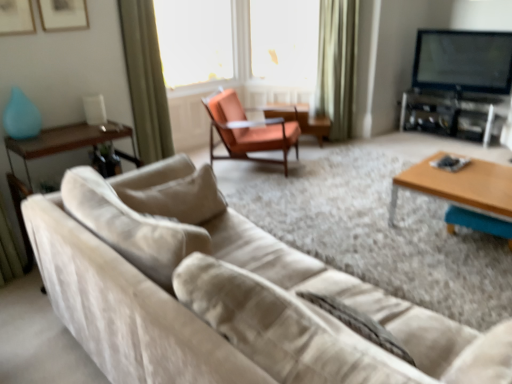
Measure the distance between point (137, 79) and camera.

The depth of point (137, 79) is 3.08 meters.

The width and height of the screenshot is (512, 384). Find the location of `transparent plastic screen at upper center, acting as the 2th window screen starting from the left`. transparent plastic screen at upper center, acting as the 2th window screen starting from the left is located at coordinates (284, 42).

Is suede beige couch at lower left next to green velvet curtain at upper center, positioned as the 2th curtain in front-to-back order, and touching it?

No, suede beige couch at lower left is not next to green velvet curtain at upper center, positioned as the 2th curtain in front-to-back order.

Is point (447, 362) farther from viewer compared to point (342, 75)?

No.

Considering the relative sizes of suede beige couch at lower left and green velvet curtain at upper center, which is counted as the second curtain, starting from the left, in the image provided, is suede beige couch at lower left shorter than green velvet curtain at upper center, which is counted as the second curtain, starting from the left,?

Yes.

Can you confirm if suede beige couch at lower left is smaller than green velvet curtain at upper center, positioned as the first curtain in back-to-front order?

No, suede beige couch at lower left is not smaller than green velvet curtain at upper center, positioned as the first curtain in back-to-front order.

Does green fabric curtain at upper left, acting as the second curtain starting from the back, turn towards transparent plastic window screen at upper center, which appears as the 1th window screen when viewed from the left?

No.

At what (x,y) coordinates should I click in order to perform the action: click on curtain located in front of the transparent plastic window screen at upper center, which appears as the 1th window screen when viewed from the left. Please return your answer as a coordinate pair (x, y). Image resolution: width=512 pixels, height=384 pixels. Looking at the image, I should click on (145, 80).

Considering the positions of objects green fabric curtain at upper left, marked as the first curtain in a front-to-back arrangement, and transparent plastic window screen at upper center, which ranks as the 2th window screen in right-to-left order, in the image provided, who is behind, green fabric curtain at upper left, marked as the first curtain in a front-to-back arrangement, or transparent plastic window screen at upper center, which ranks as the 2th window screen in right-to-left order,?

transparent plastic window screen at upper center, which ranks as the 2th window screen in right-to-left order, is further away from the camera.

From the image's perspective, would you say wooden/matte coffee table at right is shown under orange leather chair at center?

Indeed, from the image's perspective, wooden/matte coffee table at right is shown beneath orange leather chair at center.

From a real-world perspective, which is physically above, wooden/matte coffee table at right or orange leather chair at center?

From a 3D spatial view, orange leather chair at center is above.

Which is farther, (489, 166) or (232, 117)?

Positioned behind is point (232, 117).

Is wooden/matte coffee table at right taller or shorter than orange leather chair at center?

In the image, wooden/matte coffee table at right appears to be shorter than orange leather chair at center.

Does point (153, 149) come closer to viewer compared to point (23, 227)?

No, (153, 149) is further to viewer.

From the image's perspective, is green fabric curtain at upper left, the first curtain viewed from the left, located beneath wooden glossy side table at left, placed as the second side table when sorted from right to left?

Actually, green fabric curtain at upper left, the first curtain viewed from the left, appears above wooden glossy side table at left, placed as the second side table when sorted from right to left, in the image.

Is green fabric curtain at upper left, arranged as the 2th curtain when viewed from the right, aimed at wooden glossy side table at left, the 1th side table positioned from the front?

No, green fabric curtain at upper left, arranged as the 2th curtain when viewed from the right, is not turned towards wooden glossy side table at left, the 1th side table positioned from the front.

You are a GUI agent. You are given a task and a screenshot of the screen. Output one action in this format:
    pyautogui.click(x=<x>, y=<y>)
    Task: Click on the side table lying on the left of green fabric curtain at upper left, acting as the second curtain starting from the back
    This screenshot has width=512, height=384.
    Given the screenshot: What is the action you would take?
    pyautogui.click(x=60, y=152)

What's the angular difference between metallic silver entertainment center at right and green velvet curtain at upper center, which is counted as the second curtain, starting from the left,'s facing directions?

35.4 degrees.

Is metallic silver entertainment center at right oriented away from green velvet curtain at upper center, positioned as the 2th curtain in front-to-back order?

That's not correct — metallic silver entertainment center at right is not looking away from green velvet curtain at upper center, positioned as the 2th curtain in front-to-back order.

From a real-world perspective, which object rests below the other?

metallic silver entertainment center at right.

Is metallic silver entertainment center at right not inside green velvet curtain at upper center, which is counted as the second curtain, starting from the left?

Absolutely, metallic silver entertainment center at right is external to green velvet curtain at upper center, which is counted as the second curtain, starting from the left.

I want to click on side table on the right of green fabric curtain at upper left, acting as the second curtain starting from the back, so click(x=300, y=118).

From the image's perspective, does matte wood side table at center, marked as the 1th side table in a top-to-bottom arrangement, appear higher than green fabric curtain at upper left, the first curtain viewed from the left?

Yes, from the image's perspective, matte wood side table at center, marked as the 1th side table in a top-to-bottom arrangement, is above green fabric curtain at upper left, the first curtain viewed from the left.

Is matte wood side table at center, the second side table positioned from the left, closer to camera compared to green fabric curtain at upper left, arranged as the 2th curtain when viewed from the right?

No, matte wood side table at center, the second side table positioned from the left, is further to the viewer.

Does matte wood side table at center, marked as the first side table in a right-to-left arrangement, turn towards green fabric curtain at upper left, acting as the second curtain starting from the back?

Yes, matte wood side table at center, marked as the first side table in a right-to-left arrangement, faces towards green fabric curtain at upper left, acting as the second curtain starting from the back.

Is there a large distance between green fabric curtain at upper left, arranged as the 2th curtain when viewed from the right, and transparent plastic screen at upper center, acting as the 2th window screen starting from the left?

green fabric curtain at upper left, arranged as the 2th curtain when viewed from the right, is far away from transparent plastic screen at upper center, acting as the 2th window screen starting from the left.

Can you confirm if green fabric curtain at upper left, arranged as the 2th curtain when viewed from the right, is shorter than transparent plastic screen at upper center, arranged as the 1th window screen when viewed from the right?

No, green fabric curtain at upper left, arranged as the 2th curtain when viewed from the right, is not shorter than transparent plastic screen at upper center, arranged as the 1th window screen when viewed from the right.

At what (x,y) coordinates should I click in order to perform the action: click on studio couch to the left of green velvet curtain at upper center, positioned as the 2th curtain in front-to-back order. Please return your answer as a coordinate pair (x, y). Looking at the image, I should click on (125, 309).

I want to click on the 1st window screen above the green fabric curtain at upper left, marked as the first curtain in a front-to-back arrangement (from the image's perspective), so click(x=194, y=40).

When comparing their distances from green fabric curtain at upper left, marked as the first curtain in a front-to-back arrangement, does suede beige couch at lower left or orange leather chair at center seem further?

suede beige couch at lower left.

Looking at the image, which one is located closer to suede beige couch at lower left, green fabric curtain at upper left, acting as the second curtain starting from the back, or green velvet curtain at upper center, which is counted as the second curtain, starting from the left?

green fabric curtain at upper left, acting as the second curtain starting from the back, is closer to suede beige couch at lower left.

From the image, which object appears to be nearer to matte wood side table at center, the first side table when ordered from back to front, orange leather chair at center or transparent plastic window screen at upper center, which ranks as the 2th window screen in right-to-left order?

Among the two, orange leather chair at center is located nearer to matte wood side table at center, the first side table when ordered from back to front.

Which object lies nearer to the anchor point wooden/matte coffee table at right, orange leather chair at center or transparent plastic screen at upper center, acting as the 2th window screen starting from the left?

Based on the image, orange leather chair at center appears to be nearer to wooden/matte coffee table at right.

Based on the photo, from the image, which object appears to be nearer to transparent plastic window screen at upper center, which appears as the 1th window screen when viewed from the left, green fabric curtain at upper left, the first curtain viewed from the left, or wooden glossy side table at left, the 2th side table positioned from the back?

green fabric curtain at upper left, the first curtain viewed from the left, is closer to transparent plastic window screen at upper center, which appears as the 1th window screen when viewed from the left.

Considering their positions, is matte wood side table at center, marked as the second side table in a front-to-back arrangement, positioned closer to transparent plastic window screen at upper center, which ranks as the 2th window screen in right-to-left order, than suede beige couch at lower left?

Among the two, matte wood side table at center, marked as the second side table in a front-to-back arrangement, is located nearer to transparent plastic window screen at upper center, which ranks as the 2th window screen in right-to-left order.

Considering their positions, is wooden/matte coffee table at right positioned further to metallic silver entertainment center at right than orange leather chair at center?

wooden/matte coffee table at right lies further to metallic silver entertainment center at right than the other object.

Based on their spatial positions, is transparent plastic screen at upper center, acting as the 2th window screen starting from the left, or green fabric curtain at upper left, acting as the second curtain starting from the back, closer to green velvet curtain at upper center, positioned as the 2th curtain in front-to-back order?

Among the two, transparent plastic screen at upper center, acting as the 2th window screen starting from the left, is located nearer to green velvet curtain at upper center, positioned as the 2th curtain in front-to-back order.

Locate an element on the screen. This screenshot has width=512, height=384. curtain located between suede beige couch at lower left and green velvet curtain at upper center, positioned as the 2th curtain in front-to-back order, in the depth direction is located at coordinates click(x=145, y=80).

Locate an element on the screen. Image resolution: width=512 pixels, height=384 pixels. chair between wooden glossy side table at left, the 1th side table from the bottom, and metallic silver entertainment center at right from left to right is located at coordinates (249, 130).

Where is `side table located between transparent plastic window screen at upper center, which appears as the 1th window screen when viewed from the left, and flat-screen tv at upper right in the left-right direction`? The image size is (512, 384). side table located between transparent plastic window screen at upper center, which appears as the 1th window screen when viewed from the left, and flat-screen tv at upper right in the left-right direction is located at coordinates (300, 118).

Identify the location of chair between wooden/matte coffee table at right and green velvet curtain at upper center, which is counted as the second curtain, starting from the left, along the z-axis. This screenshot has height=384, width=512. (249, 130).